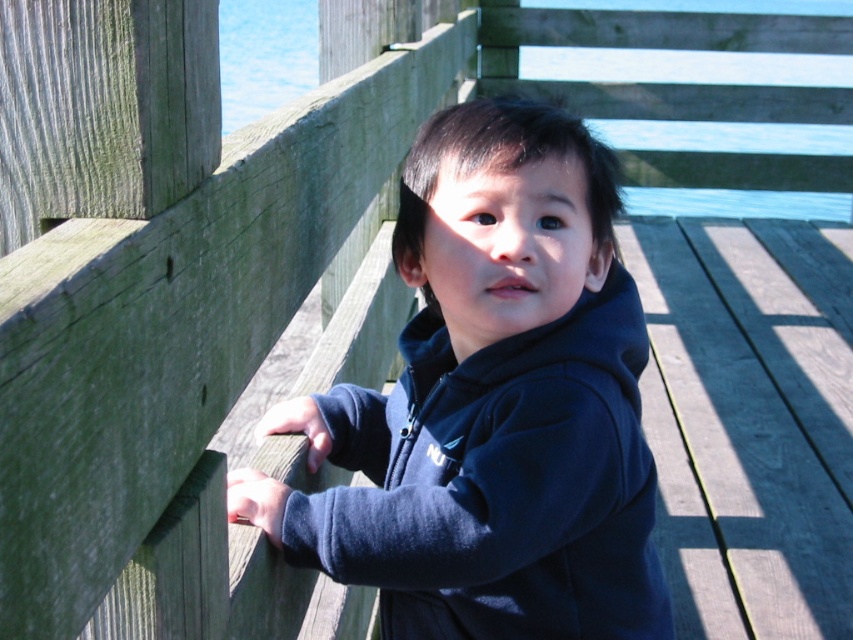
Between point (508, 128) and point (252, 70), which one is positioned behind?

The point (252, 70) is behind.

Can you confirm if dark blue fleece at center is smaller than blue water at upper left?

Incorrect, dark blue fleece at center is not smaller in size than blue water at upper left.

Is point (409, 458) closer to camera compared to point (619, 52)?

Yes, point (409, 458) is closer to viewer.

What are the coordinates of `dark blue fleece at center` in the screenshot? It's located at (500, 401).

Which is in front, point (601, 214) or point (268, 499)?

Point (268, 499)

Does dark blue fleece at center have a greater height compared to matte black hand at center?

Indeed, dark blue fleece at center has a greater height compared to matte black hand at center.

Locate an element on the screen. Image resolution: width=853 pixels, height=640 pixels. dark blue fleece at center is located at coordinates (500, 401).

Where is `dark blue fleece at center`? This screenshot has height=640, width=853. dark blue fleece at center is located at coordinates (500, 401).

Does blue water at upper left have a lesser height compared to matte black hand at center?

Yes, blue water at upper left is shorter than matte black hand at center.

Who is taller, blue water at upper left or matte black hand at center?

With more height is matte black hand at center.

Locate an element on the screen. The width and height of the screenshot is (853, 640). blue water at upper left is located at coordinates (734, 164).